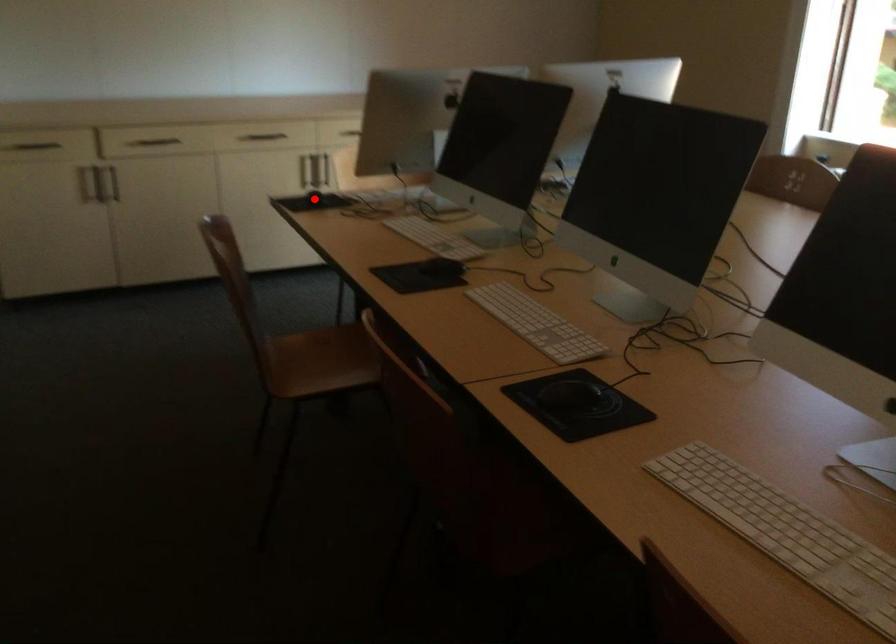
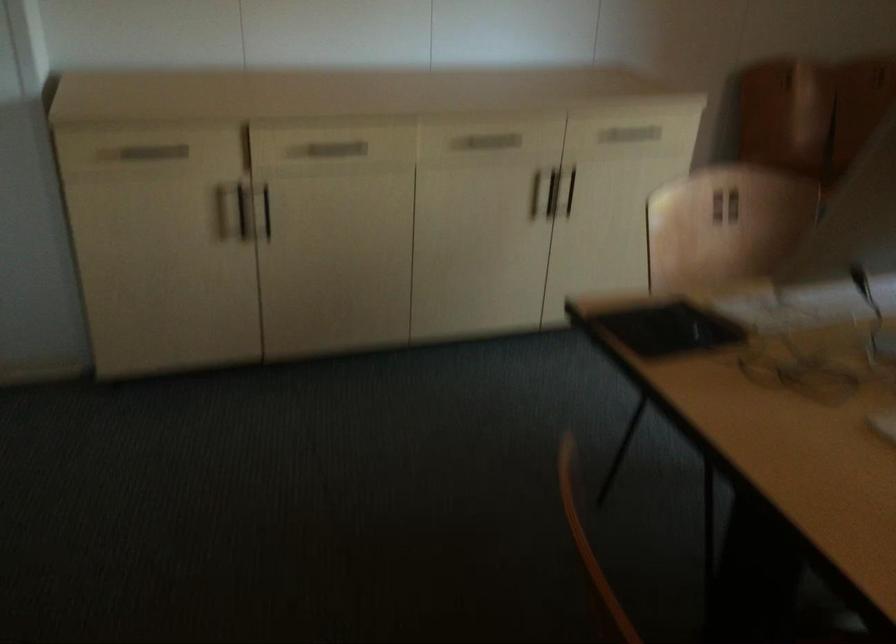
Question: I am providing you with two images of the same scene from different viewpoints. In image1, a red point is highlighted. Considering the same 3D point in image2, which of the following is correct?

Choices:
 (A) It is closer
 (B) It is farther

Answer: (A)